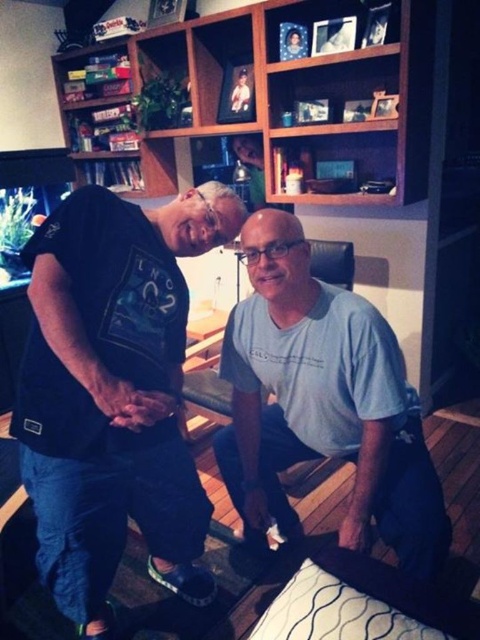
You are a tailor measuring clothing for a customer. You see the light blue cotton shirt at center and the wooden bookshelf at upper center. Which item is shorter in height?

The light blue cotton shirt at center is shorter than the wooden bookshelf at upper center.